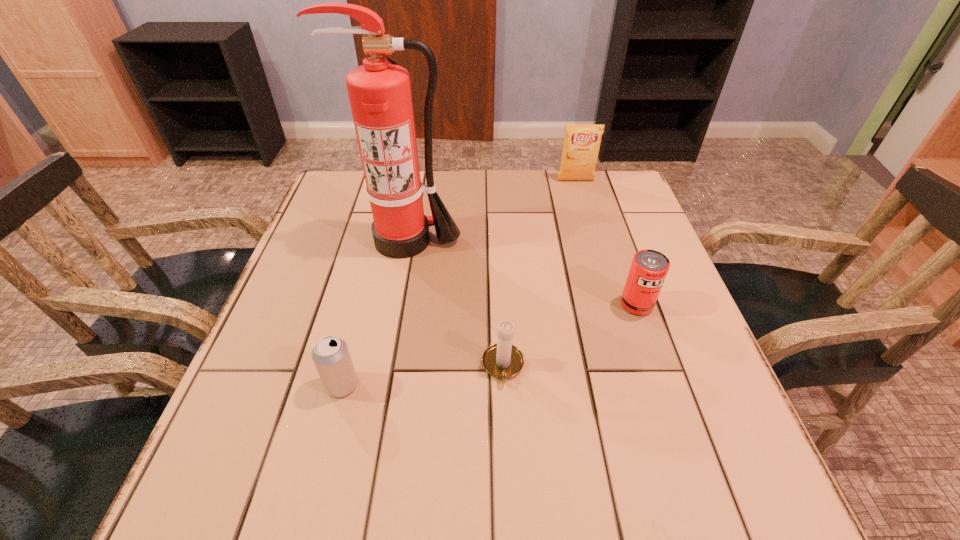
I want to click on free point between the beer can and the candle holder, so click(422, 375).

Locate an element on the screen. This screenshot has width=960, height=540. free area in between the farthest object and the third nearest object is located at coordinates (606, 242).

The width and height of the screenshot is (960, 540). In order to click on vacant area between the tallest object and the third object from right to left in this screenshot , I will do `click(455, 303)`.

Find the location of `object that is the second closest to the third nearest object`. object that is the second closest to the third nearest object is located at coordinates (379, 92).

Choose which object is the third nearest neighbor to the crisp (potato chip). Please provide its 2D coordinates. Your answer should be formatted as a tuple, i.e. [(x, y)], where the tuple contains the x and y coordinates of a point satisfying the conditions above.

[(502, 360)]

Where is `free region that satisfies the following two spatial constraints: 1. at the nozzle of the fourth nearest object; 2. on the left side of the third nearest object`? This screenshot has width=960, height=540. free region that satisfies the following two spatial constraints: 1. at the nozzle of the fourth nearest object; 2. on the left side of the third nearest object is located at coordinates (395, 305).

Where is `free spot that satisfies the following two spatial constraints: 1. on the front of the can with the logo; 2. on the left side of the farthest object`? free spot that satisfies the following two spatial constraints: 1. on the front of the can with the logo; 2. on the left side of the farthest object is located at coordinates (612, 305).